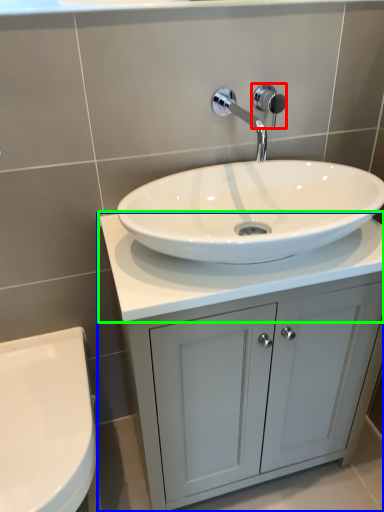
Question: Which object is positioned farthest from shower (highlighted by a red box)? Select from bathroom cabinet (highlighted by a blue box) and counter top (highlighted by a green box).

Choices:
 (A) bathroom cabinet
 (B) counter top

Answer: (A)